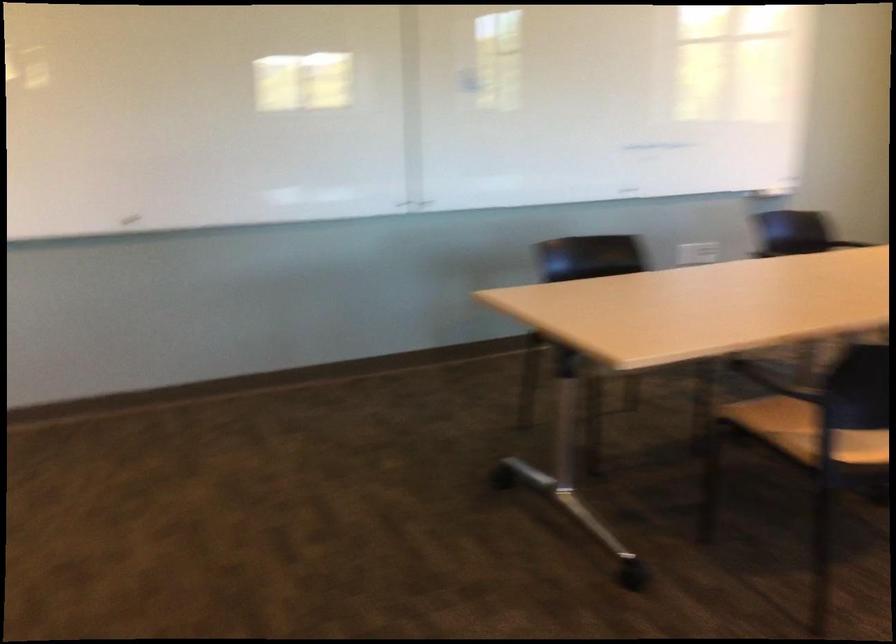
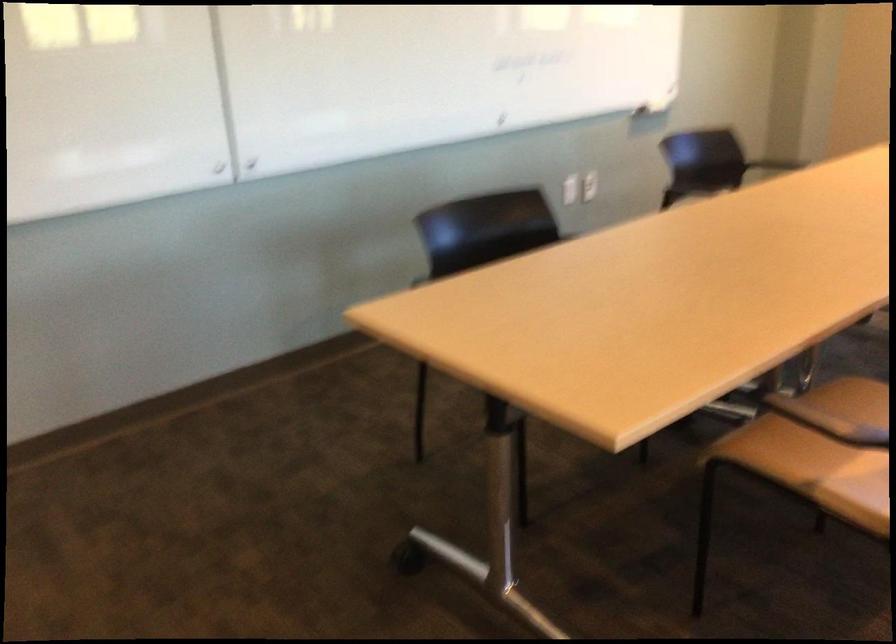
The point at (682,245) is marked in the first image. Where is the corresponding point in the second image?

(570, 189)